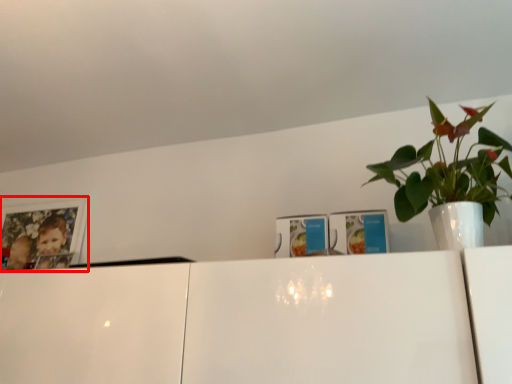
Question: From the image's perspective, what is the correct spatial relationship of picture frame (annotated by the red box) in relation to houseplant?

Choices:
 (A) below
 (B) above

Answer: (A)